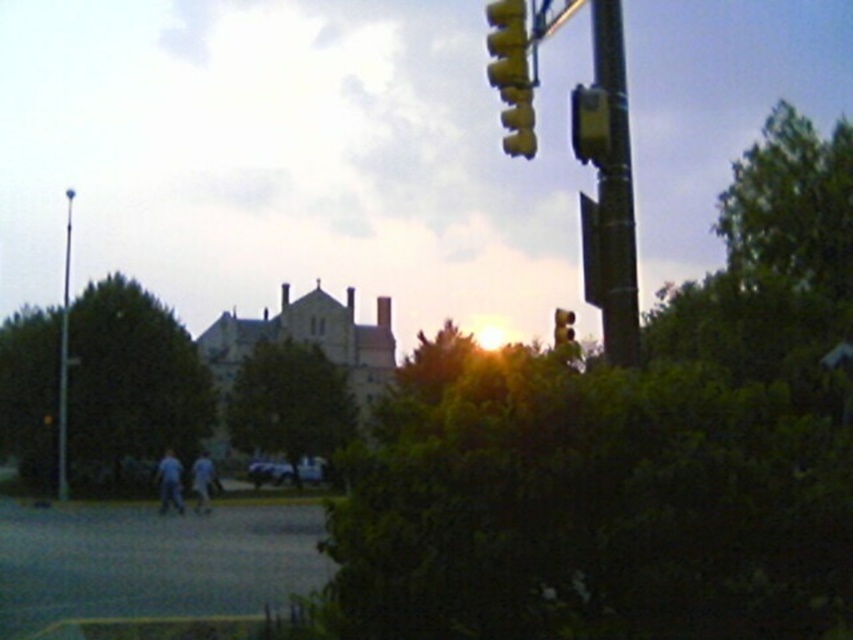
You are standing at point (x=132, y=378) in the scene. What object is located exactly at your current position?

At point (x=132, y=378) lies green leafy tree at left.

You are a pedestrian standing at the light blue jeans at lower left position. You want to cross the street to reach a store located near the metallic yellow traffic light at upper right. The crosswalk is directly in front of you. Given that the crosswalk is 25 meters long, will you be able to reach the store without stepping off the crosswalk?

The metallic yellow traffic light at upper right and light blue jeans at lower left are 25.54 meters apart. Since the crosswalk is only 25 meters long, the crosswalk is shorter than the distance between the two points. Therefore, you will step off the crosswalk before reaching the store.

You are a pedestrian standing at the point with coordinates point (549, 17). You want to cross the street to reach the park located to the north. Which direction should you walk to avoid the traffic signal pole on the right side?

The point (549, 17) is on the metallic yellow traffic light at upper right, so to avoid the traffic signal pole on the right side, you should walk north towards the park while staying away from the pole.